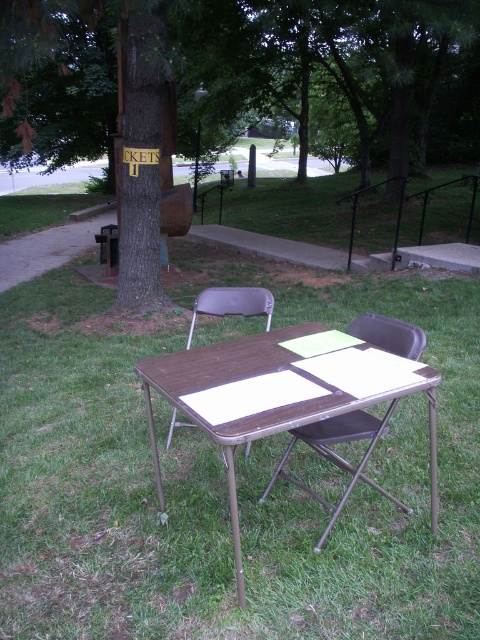
Question: Is brown/metallic picnic table at center to the left of brown metal chair at center from the viewer's perspective?

Choices:
 (A) no
 (B) yes

Answer: (B)

Question: Can you confirm if green grass at center is bigger than brown metal chair at center?

Choices:
 (A) no
 (B) yes

Answer: (A)

Question: Which of the following is the closest to the observer?

Choices:
 (A) brown/metallic picnic table at center
 (B) brown plastic chair at center

Answer: (A)

Question: Which object is closer to the camera taking this photo?

Choices:
 (A) brown wood tree at center
 (B) brown metal chair at center
 (C) brown/metallic picnic table at center

Answer: (C)

Question: Estimate the real-world distances between objects in this image. Which object is closer to the brown/metallic picnic table at center?

Choices:
 (A) green grass at center
 (B) brown plastic chair at center

Answer: (B)

Question: Is brown wood tree at center closer to the viewer compared to brown metal chair at center?

Choices:
 (A) yes
 (B) no

Answer: (B)